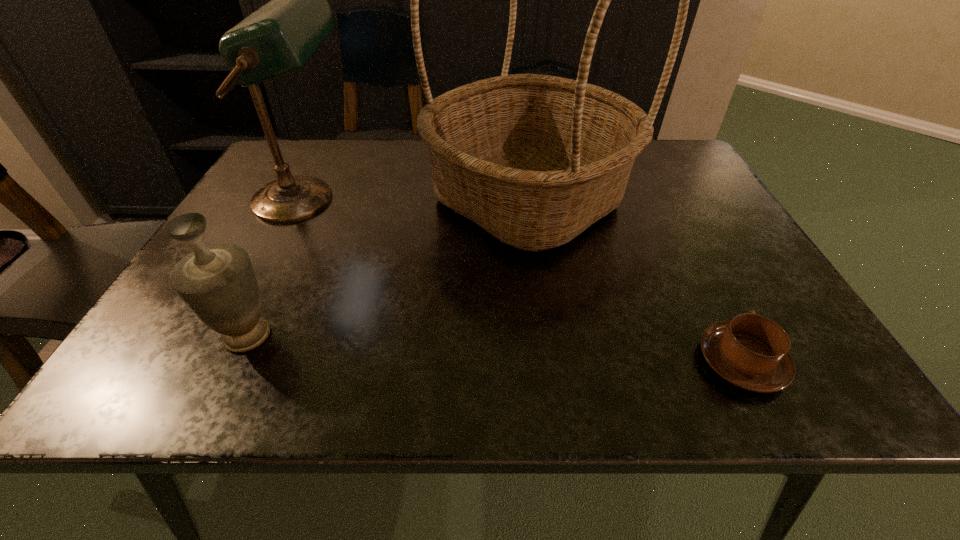
The width and height of the screenshot is (960, 540). I want to click on vacant area that lies between the table lamp and the cappuccino, so click(523, 281).

I want to click on free space between the basket and the shortest object, so click(x=634, y=280).

This screenshot has height=540, width=960. I want to click on vacant space that is in between the second shortest object and the tallest object, so click(387, 267).

Where is `empty location between the third object from left to right and the second tallest object`? The width and height of the screenshot is (960, 540). empty location between the third object from left to right and the second tallest object is located at coordinates (416, 199).

This screenshot has height=540, width=960. Find the location of `empty space that is in between the urn and the table lamp`. empty space that is in between the urn and the table lamp is located at coordinates (276, 267).

Find the location of a particular element. The width and height of the screenshot is (960, 540). free spot between the second tallest object and the cappuccino is located at coordinates (523, 281).

This screenshot has width=960, height=540. What are the coordinates of `free area in between the tallest object and the second shortest object` in the screenshot? It's located at (387, 267).

Locate which object ranks third in proximity to the cappuccino. Please provide its 2D coordinates. Your answer should be formatted as a tuple, i.e. [(x, y)], where the tuple contains the x and y coordinates of a point satisfying the conditions above.

[(217, 283)]

Identify the location of object that is the third closest to the urn. The image size is (960, 540). (751, 352).

This screenshot has width=960, height=540. Find the location of `free location that satisfies the following two spatial constraints: 1. on the side of the cappuccino with the handle; 2. above the green lampshade of the table lamp`. free location that satisfies the following two spatial constraints: 1. on the side of the cappuccino with the handle; 2. above the green lampshade of the table lamp is located at coordinates (659, 200).